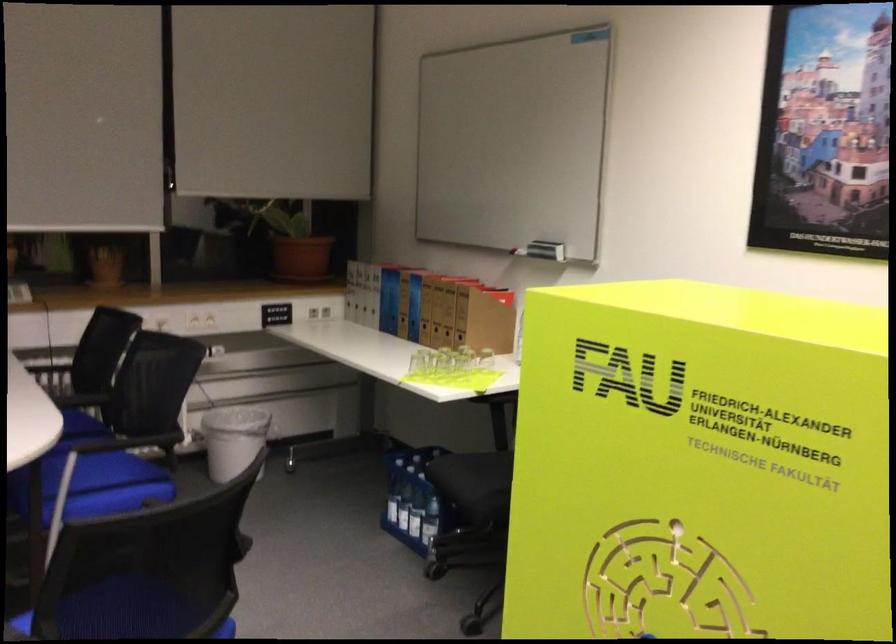
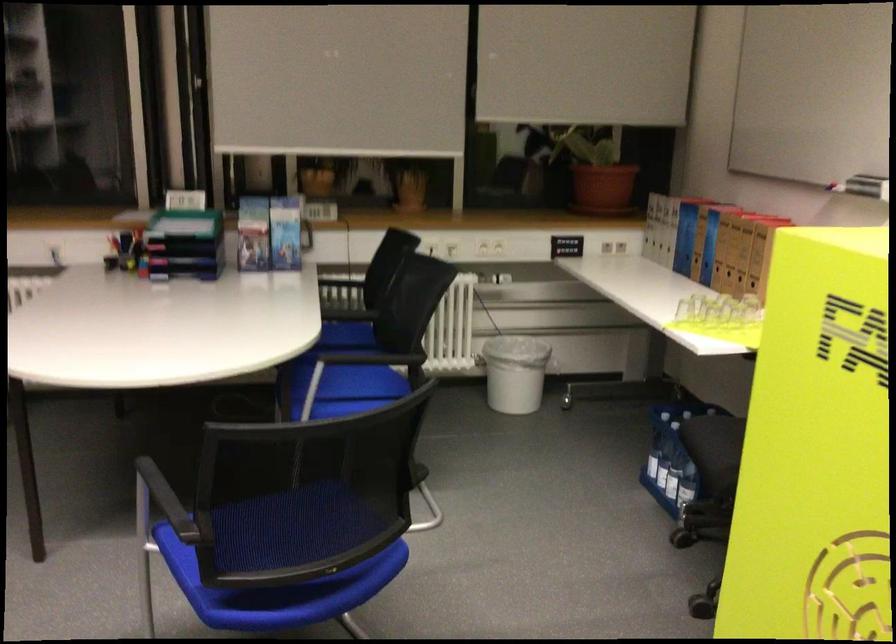
Question: The images are taken continuously from a first-person perspective. In which direction is your viewpoint rotating?

Choices:
 (A) Left
 (B) Right
 (C) Up
 (D) Down

Answer: (A)